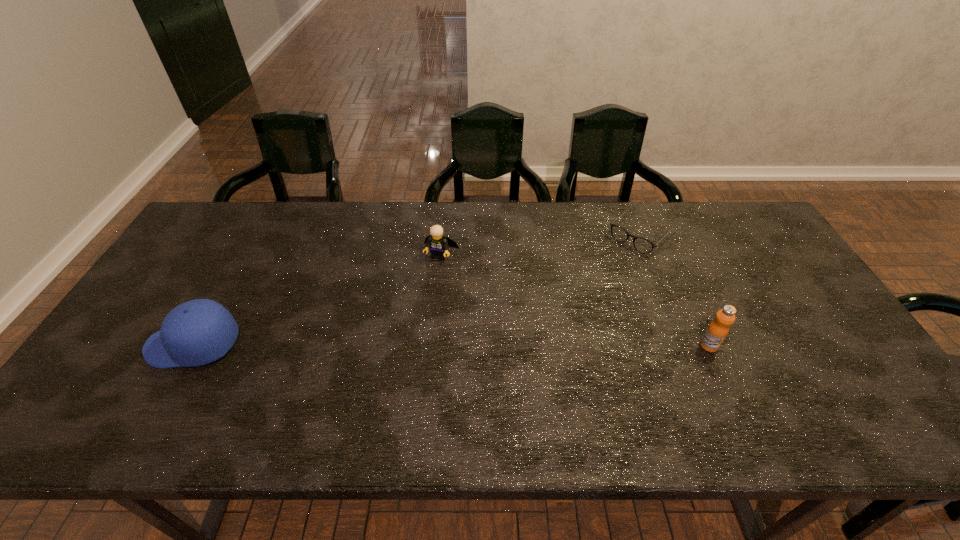
This screenshot has width=960, height=540. In the image, there is a desktop. Find the location of `vacant space at the near left corner`. vacant space at the near left corner is located at coordinates (124, 376).

The width and height of the screenshot is (960, 540). In the image, there is a desktop. In order to click on free space at the far right corner in this screenshot , I will do `click(739, 219)`.

This screenshot has width=960, height=540. In the image, there is a desktop. Identify the location of free region at the near right corner. (865, 379).

The height and width of the screenshot is (540, 960). Find the location of `vacant area that lies between the spectacles and the orange juice`. vacant area that lies between the spectacles and the orange juice is located at coordinates (676, 290).

Find the location of a particular element. free space between the cap and the spectacles is located at coordinates coord(418,289).

Find the location of a particular element. unoccupied position between the leftmost object and the spectacles is located at coordinates (418, 289).

The height and width of the screenshot is (540, 960). In order to click on vacant area between the leftmost object and the orange juice in this screenshot , I will do `click(451, 345)`.

In order to click on vacant space in between the spectacles and the second object from left to right in this screenshot , I will do `click(541, 245)`.

This screenshot has width=960, height=540. What are the coordinates of `empty location between the leftmost object and the orange juice` in the screenshot? It's located at (451, 345).

Identify the location of free space between the shortest object and the orange juice. Image resolution: width=960 pixels, height=540 pixels. (676, 290).